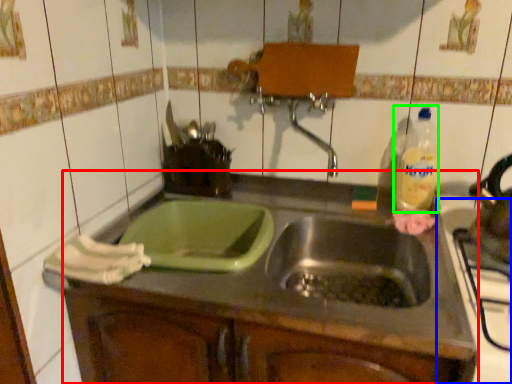
Question: Which is farther away from countertop (highlighted by a red box)? appliance (highlighted by a blue box) or bottle (highlighted by a green box)?

Choices:
 (A) appliance
 (B) bottle

Answer: (B)